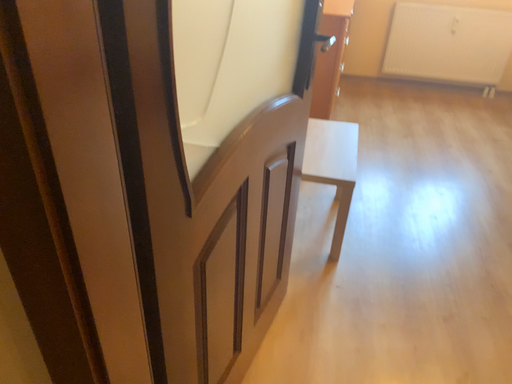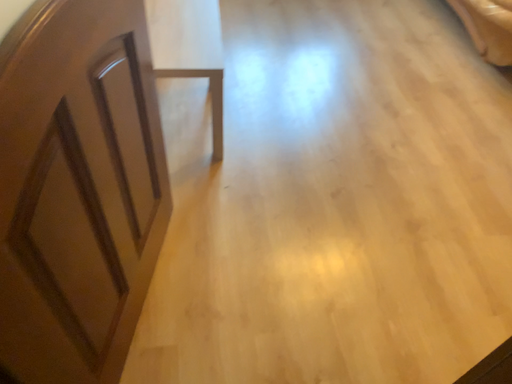
Question: Which way did the camera rotate in the video?

Choices:
 (A) rotated right
 (B) rotated left

Answer: (A)